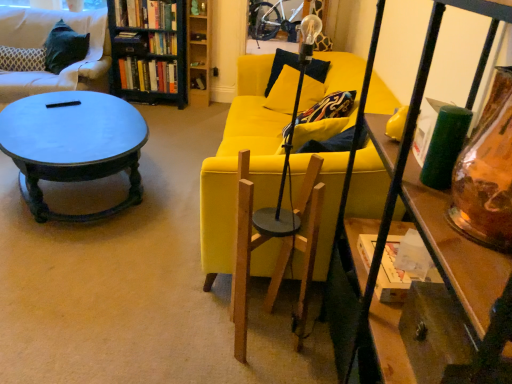
Question: Is dark gray fabric couch at upper left, the 1th studio couch from the top, in front of or behind black painted wood bookcase at upper left in the image?

Choices:
 (A) behind
 (B) front

Answer: (B)

Question: Based on their positions, is dark gray fabric couch at upper left, positioned as the 1th studio couch in left-to-right order, located to the left or right of black painted wood bookcase at upper left?

Choices:
 (A) left
 (B) right

Answer: (A)

Question: Estimate the real-world distances between objects in this image. Which object is closer to the hardcover books at upper left, which is counted as the second book, starting from the bottom?

Choices:
 (A) black painted wood bookcase at upper left
 (B) velvet black pillow at upper left
 (C) dark gray fabric couch at upper left, positioned as the 1th studio couch in left-to-right order
 (D) matte dark blue coffee table at left
 (E) yellow fabric couch at center, the second studio couch viewed from the top

Answer: (A)

Question: Estimate the real-world distances between objects in this image. Which object is farther from the black painted wood bookcase at upper left?

Choices:
 (A) dark gray fabric couch at upper left, the 1th studio couch from the top
 (B) wooden bookshelf at center
 (C) hardcover books at upper left, which ranks as the first book in bottom-to-top order
 (D) clear glass lamp at center
 (E) velvet black pillow at upper left

Answer: (D)